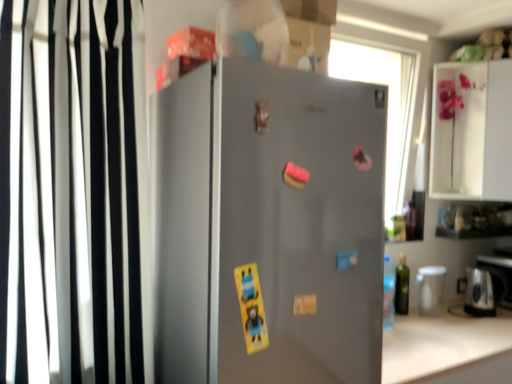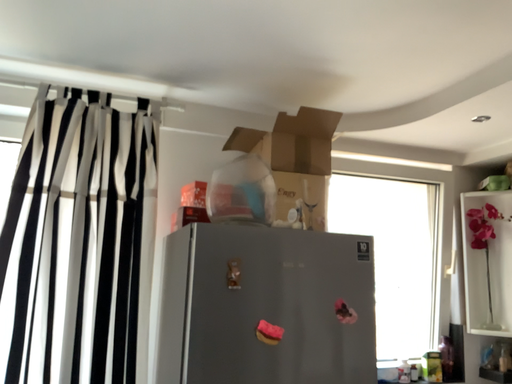
Question: How did the camera likely rotate when shooting the video?

Choices:
 (A) rotated right
 (B) rotated left

Answer: (B)